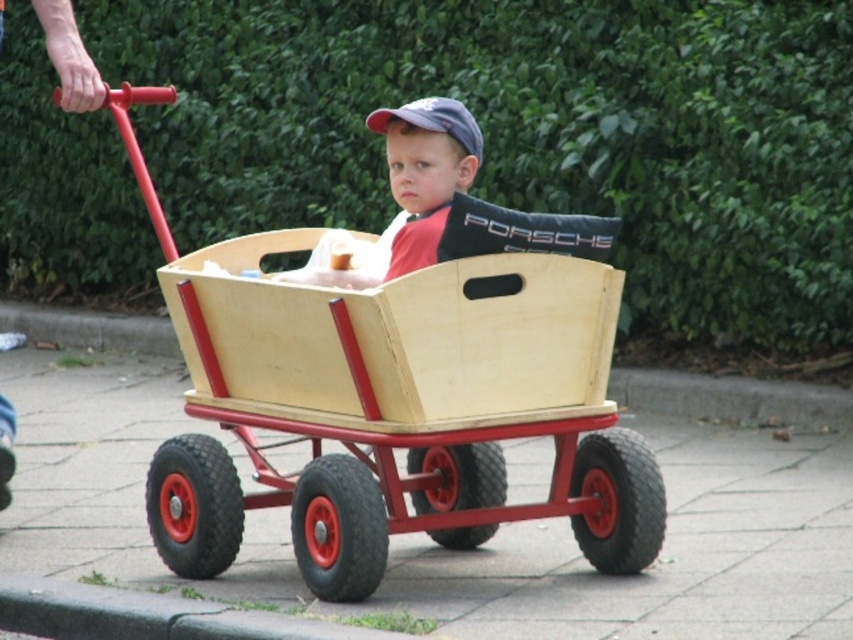
Question: Which point is farther to the camera?

Choices:
 (A) wooden wagon at center
 (B) matte wood wagon at center

Answer: (B)

Question: Can you confirm if wooden wagon at center is positioned to the right of matte wood wagon at center?

Choices:
 (A) no
 (B) yes

Answer: (A)

Question: Which point is closer to the camera?

Choices:
 (A) matte wood wagon at center
 (B) wooden wagon at center

Answer: (B)

Question: Does wooden wagon at center appear on the left side of matte wood wagon at center?

Choices:
 (A) yes
 (B) no

Answer: (A)

Question: From the image, what is the correct spatial relationship of wooden wagon at center in relation to matte wood wagon at center?

Choices:
 (A) right
 (B) left

Answer: (B)